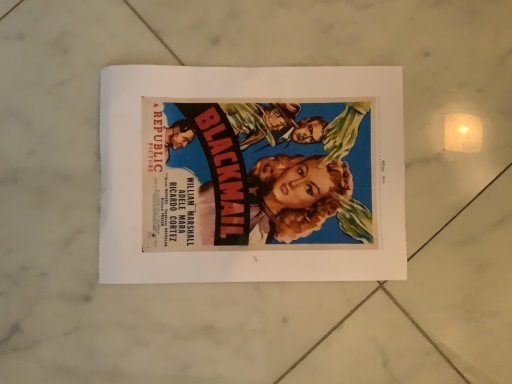
Locate an element on the screen. The image size is (512, 384). matte paper poster at center is located at coordinates (251, 174).

The height and width of the screenshot is (384, 512). What do you see at coordinates (251, 174) in the screenshot? I see `matte paper poster at center` at bounding box center [251, 174].

The height and width of the screenshot is (384, 512). In order to click on matte paper poster at center in this screenshot , I will do `click(251, 174)`.